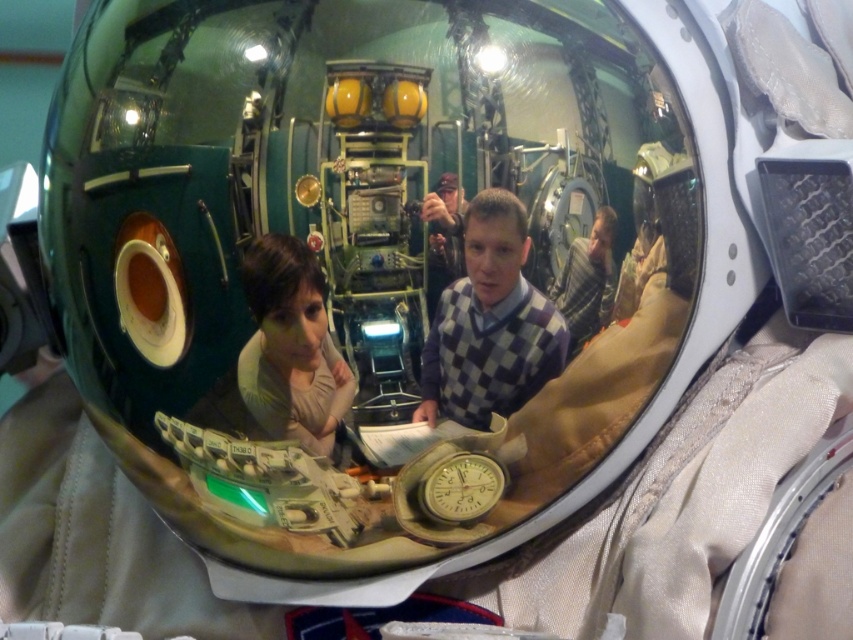
Is purple checkered sweater at center behind checkered sweater at center?

No, purple checkered sweater at center is in front of checkered sweater at center.

Between purple checkered sweater at center and checkered sweater at center, which one appears on the left side from the viewer's perspective?

Positioned to the left is purple checkered sweater at center.

Is point (511, 236) positioned after point (567, 276)?

No, (511, 236) is in front of (567, 276).

You are a GUI agent. You are given a task and a screenshot of the screen. Output one action in this format:
    pyautogui.click(x=<x>, y=<y>)
    Task: Click on the purple checkered sweater at center
    The width and height of the screenshot is (853, 640).
    Given the screenshot: What is the action you would take?
    pyautogui.click(x=490, y=323)

Where is `matte beige shirt at center`? The height and width of the screenshot is (640, 853). matte beige shirt at center is located at coordinates (291, 346).

Is purple checkered sweater at center bigger than matte beige shirt at center?

Yes.

Find the location of `purple checkered sweater at center`. purple checkered sweater at center is located at coordinates (490, 323).

Image resolution: width=853 pixels, height=640 pixels. Identify the location of purple checkered sweater at center. (490, 323).